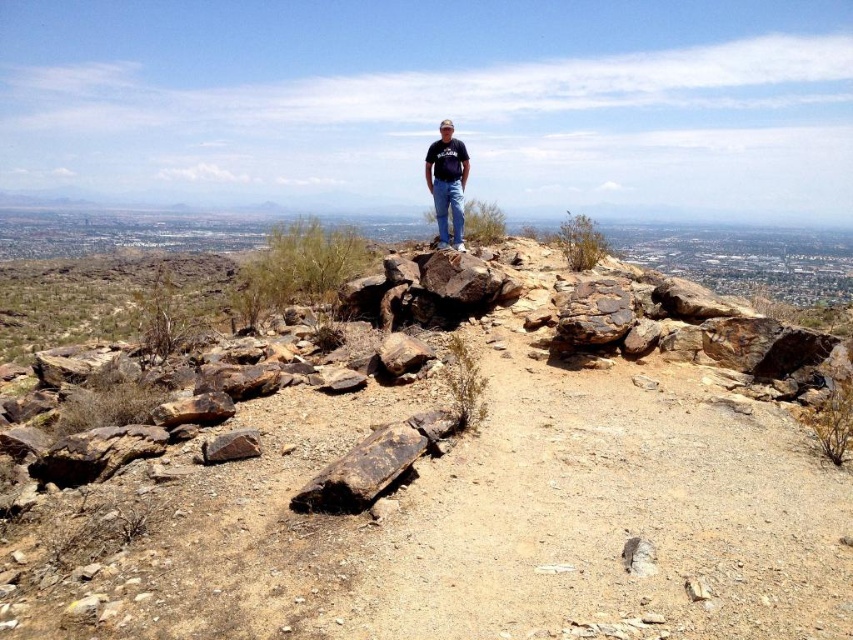
Is black cotton shirt at center positioned before brown rough rock at lower left?

No, black cotton shirt at center is further to the viewer.

Who is more forward, (442, 134) or (248, 436)?

Point (248, 436)

This screenshot has width=853, height=640. What do you see at coordinates (447, 182) in the screenshot? I see `black cotton shirt at center` at bounding box center [447, 182].

What are the coordinates of `black cotton shirt at center` in the screenshot? It's located at (447, 182).

Does brown rocky hillside at center appear on the right side of black cotton shirt at center?

In fact, brown rocky hillside at center is to the left of black cotton shirt at center.

Is point (631, 474) farther from camera compared to point (444, 179)?

No, it is not.

Find the location of a particular element. The height and width of the screenshot is (640, 853). brown rocky hillside at center is located at coordinates (456, 508).

Does point (308, 620) lie in front of point (215, 452)?

That is True.

Who is taller, brown rocky hillside at center or brown rough rock at lower left?

brown rough rock at lower left

Is point (7, 605) farther from viewer compared to point (251, 440)?

No, it is not.

Find the location of `brown rocky hillside at center`. brown rocky hillside at center is located at coordinates (456, 508).